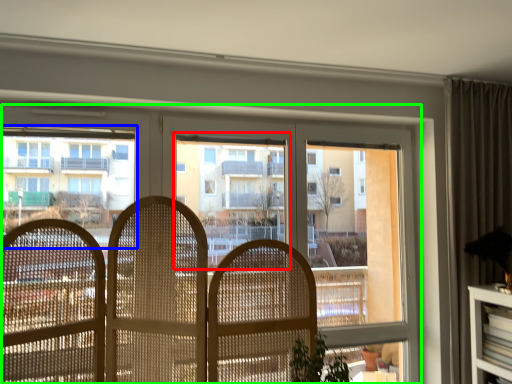
Question: Which object is positioned closest to bay window (highlighted by a red box)? Select from condominium (highlighted by a blue box) and window (highlighted by a green box).

Choices:
 (A) condominium
 (B) window

Answer: (B)